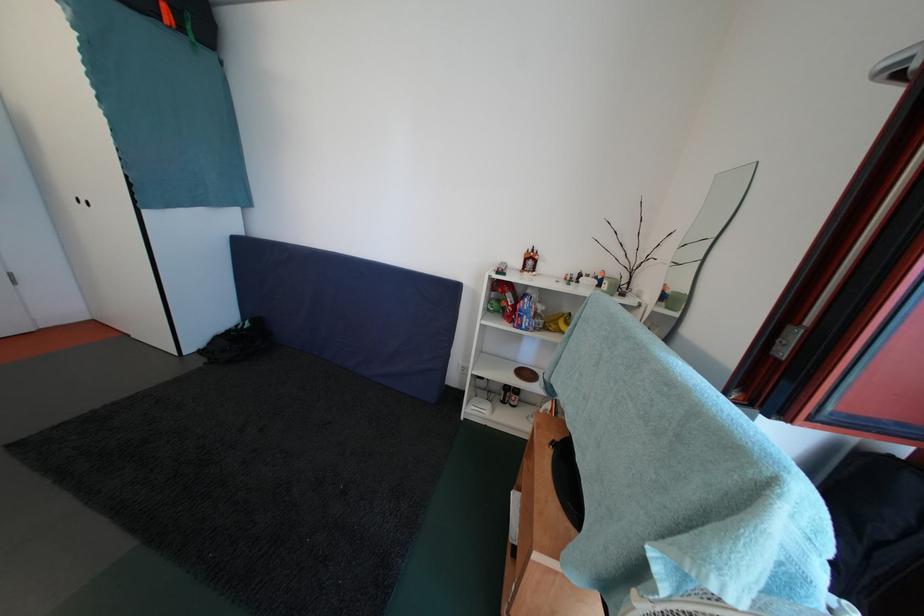
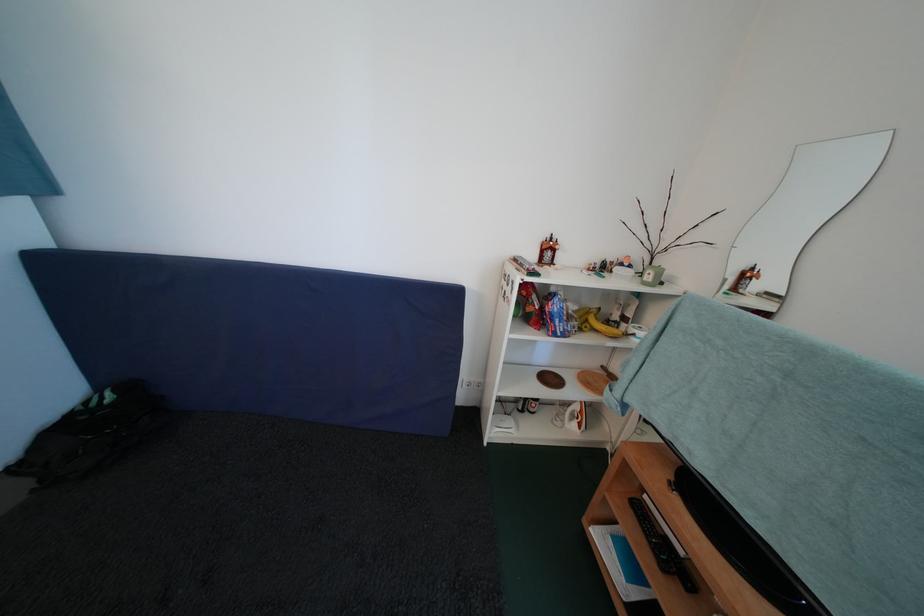
Locate, in the second image, the point that corresponds to (x=554, y=411) in the first image.

(584, 411)